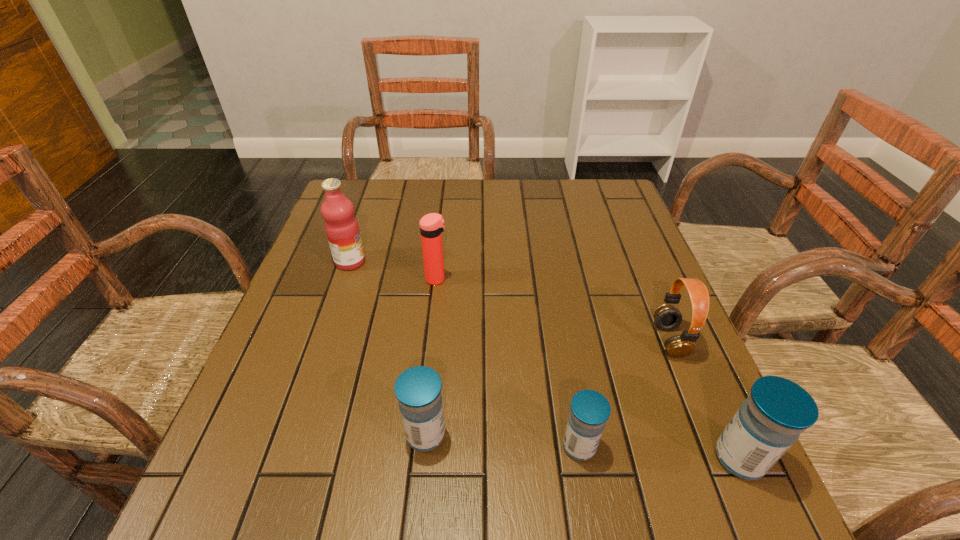
Where is `vacant space at the far edge of the desktop`? The image size is (960, 540). vacant space at the far edge of the desktop is located at coordinates (483, 202).

I want to click on vacant space at the left edge, so click(x=351, y=279).

This screenshot has height=540, width=960. Identify the location of vacant space at the right edge. (607, 278).

In the image, there is a desktop. Identify the location of vacant area at the far left corner. (359, 199).

Locate an element on the screen. Image resolution: width=960 pixels, height=540 pixels. blank space at the far right corner of the desktop is located at coordinates (601, 217).

Find the location of `vacant space that's between the fifth nearest object and the second shortest medicine`. vacant space that's between the fifth nearest object and the second shortest medicine is located at coordinates (431, 357).

You are a GUI agent. You are given a task and a screenshot of the screen. Output one action in this format:
    pyautogui.click(x=<x>, y=<y>)
    Task: Click on the free area in between the fruit juice and the thermos bottle
    
    Given the screenshot: What is the action you would take?
    point(394,271)

Where is `vacant space in between the rightmost medicine and the fourth nearest object`? vacant space in between the rightmost medicine and the fourth nearest object is located at coordinates (705, 399).

What are the coordinates of `free area in between the shortest medicine and the fourth nearest object` in the screenshot? It's located at (625, 393).

Locate an element on the screen. This screenshot has height=540, width=960. vacant area between the shortest medicine and the second shortest medicine is located at coordinates (502, 440).